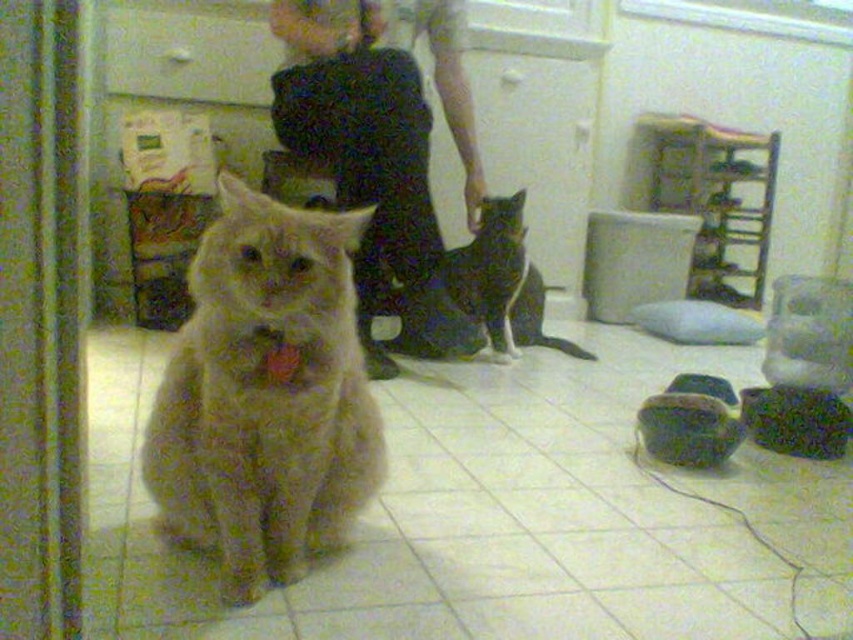
You are a delivery person who just arrived at the house. You need to place a package on the floor between the matte black pants at center and the fluffy orange cat at center. The package is 3 feet long. Is there enough space between them to place the package?

The distance between the matte black pants at center and the fluffy orange cat at center is 4.97 feet. Since the package is 3 feet long, there is sufficient space to place it between them.

You are a delivery robot with a 3.5 feet wide package. You need to navigate between the fuzzy brown cat at center and the black and white fur cat at center to deliver the package. Can you fit through the space between them?

The distance between the fuzzy brown cat at center and the black and white fur cat at center is 4.50 feet. Since the package is 3.5 feet wide, the robot can fit through the space between them as the distance is wider than the package.

You are trying to decide whether to place a small plant pot between the matte black pants at center and the white matte drawer at upper center. Given their sizes, will the plant pot fit comfortably between them?

The matte black pants at center is bigger than the white matte drawer at upper center. Since the pants are larger, there might be sufficient space between them to place a small plant pot comfortably.